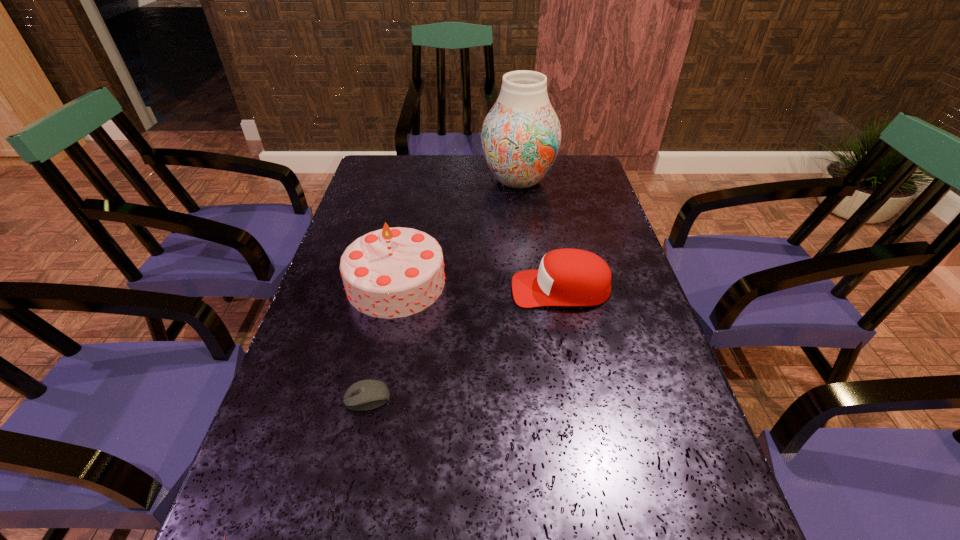
Identify the location of free region at the right edge of the desktop. (592, 356).

You are a GUI agent. You are given a task and a screenshot of the screen. Output one action in this format:
    pyautogui.click(x=<x>, y=<y>)
    Task: Click on the vacant area at the far left corner of the desktop
    
    Given the screenshot: What is the action you would take?
    pyautogui.click(x=410, y=172)

Identify the location of free space between the farther mouse and the second tallest object. The height and width of the screenshot is (540, 960). (382, 340).

Locate an element on the screen. This screenshot has height=540, width=960. blank region between the baseball cap and the fourth farthest object is located at coordinates (464, 343).

Identify the location of free space that is in between the farthest object and the birthday cake. The width and height of the screenshot is (960, 540). (457, 232).

Locate an element on the screen. The width and height of the screenshot is (960, 540). free spot between the taller mouse and the third tallest object is located at coordinates (464, 343).

Locate an element on the screen. The width and height of the screenshot is (960, 540). object that can be found as the second closest to the left mouse is located at coordinates (395, 272).

Where is `object that stands as the third closest to the leftmost object`? The height and width of the screenshot is (540, 960). object that stands as the third closest to the leftmost object is located at coordinates (566, 277).